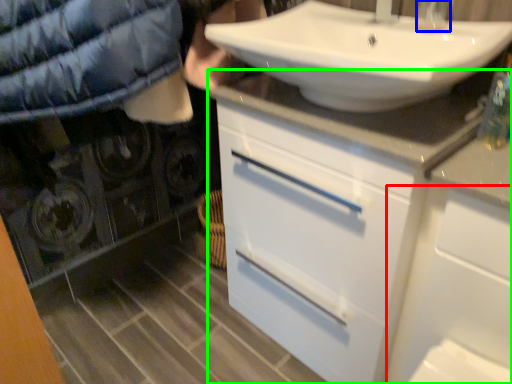
Question: Based on their relative distances, which object is farther from cabinetry (highlighted by a red box)? Choose from faucet (highlighted by a blue box) and bathroom cabinet (highlighted by a green box).

Choices:
 (A) faucet
 (B) bathroom cabinet

Answer: (A)